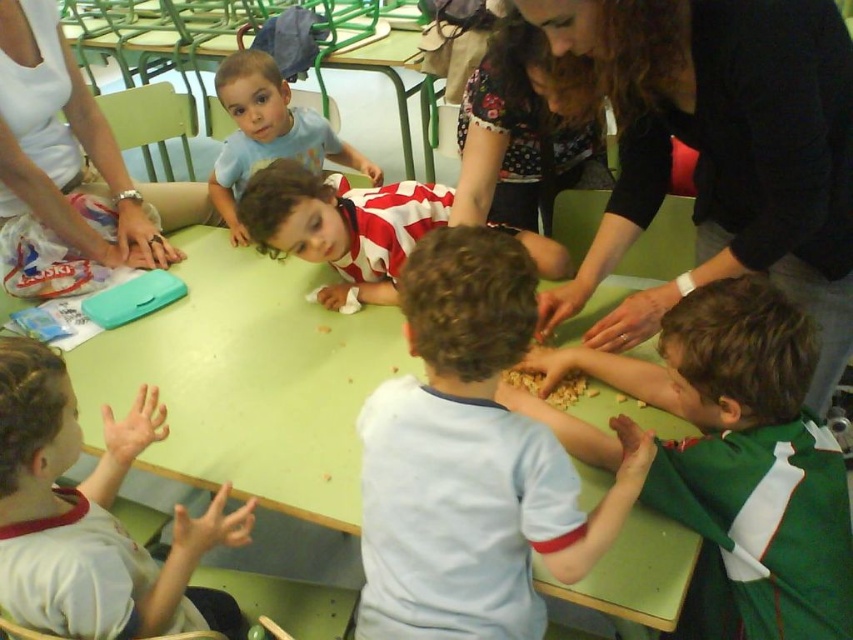
You are a teacher observing the classroom scene. You need to determine which item is narrower between the light gray shirt at lower left and the white fabric at upper left. Which one is it?

The light gray shirt at lower left has a lesser width compared to the white fabric at upper left, so the light gray shirt at lower left is narrower.